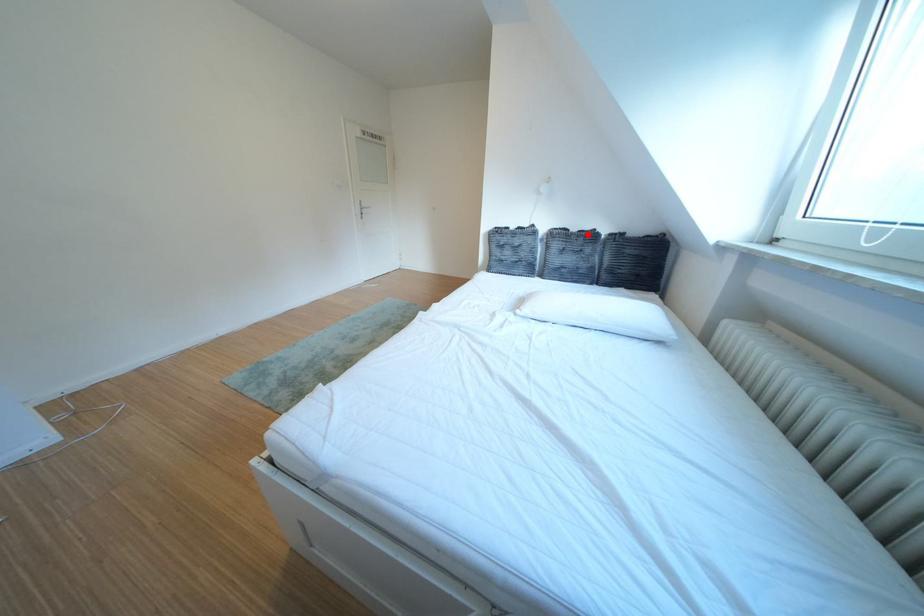
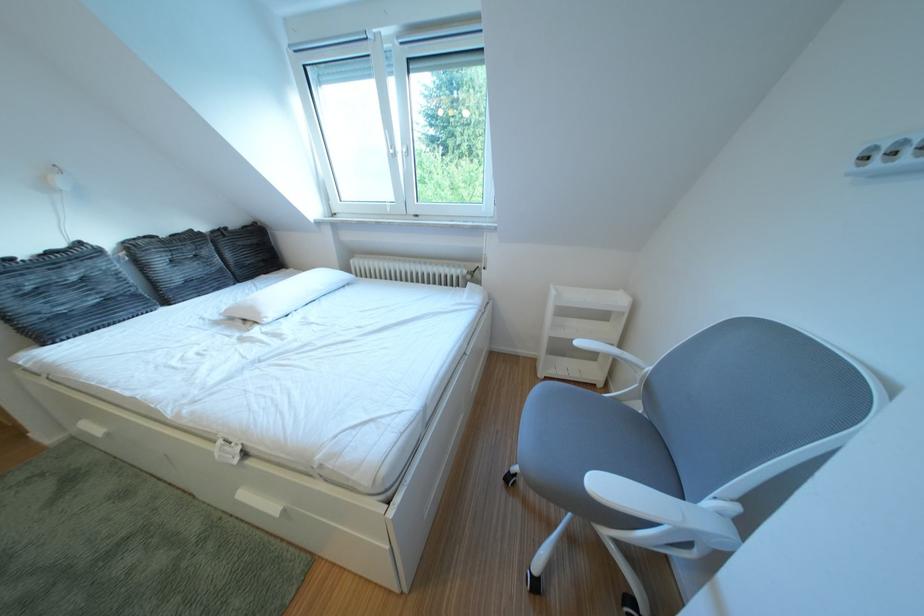
Question: I am providing you with two images of the same scene from different viewpoints. Image1 has a red point marked. In image2, the corresponding 3D location appears at what relative position? Reply with the corresponding letter.

Choices:
 (A) Closer
 (B) Farther

Answer: (B)